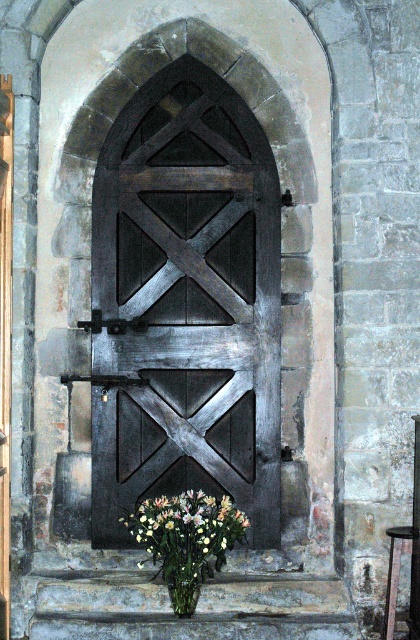
You are an interior designer planning to place a new decorative item in the space. Given the dark wood barn door at center and the white matte vase at center, which object should you consider if you want to place a larger item next to it?

The dark wood barn door at center is bigger than the white matte vase at center, so you should consider placing the larger item next to the dark wood barn door at center since it already occupies more space.